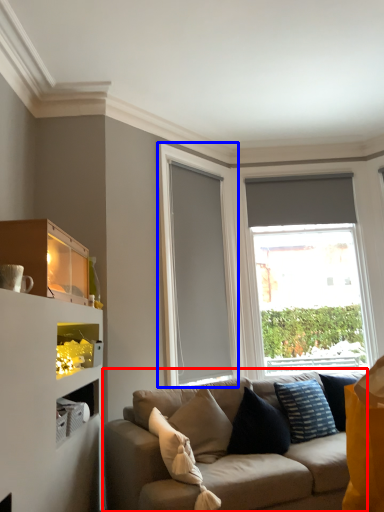
Question: Among these objects, which one is nearest to the camera, studio couch (highlighted by a red box) or glass door (highlighted by a blue box)?

Choices:
 (A) studio couch
 (B) glass door

Answer: (A)